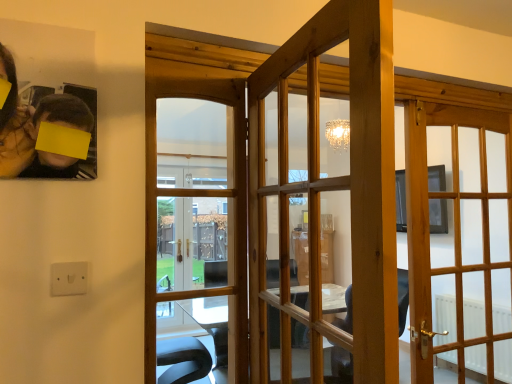
What is the approximate height of white plastic electric outlet at lower left?

The height of white plastic electric outlet at lower left is 3.66 inches.

Locate an element on the screen. wooden glass door at center, arranged as the 1th door when viewed from the left is located at coordinates (196, 232).

Describe the element at coordinates (460, 240) in the screenshot. I see `light wood door at right, which is the third door in left-to-right order` at that location.

You are a GUI agent. You are given a task and a screenshot of the screen. Output one action in this format:
    pyautogui.click(x=<x>, y=<y>)
    Task: Click on the light wood door at right, acting as the 1th door starting from the right
    Image resolution: width=512 pixels, height=384 pixels.
    Given the screenshot: What is the action you would take?
    pyautogui.click(x=460, y=240)

The width and height of the screenshot is (512, 384). Find the location of `white plastic electric outlet at lower left`. white plastic electric outlet at lower left is located at coordinates click(x=69, y=278).

Considering the positions of objects white plastic electric outlet at lower left and light wood door at right, placed as the 1th door when sorted from back to front, in the image provided, who is more to the left, white plastic electric outlet at lower left or light wood door at right, placed as the 1th door when sorted from back to front,?

white plastic electric outlet at lower left is more to the left.

Where is `electric outlet on the left side of light wood door at right, placed as the 1th door when sorted from back to front`? electric outlet on the left side of light wood door at right, placed as the 1th door when sorted from back to front is located at coordinates (69, 278).

From the image's perspective, would you say white plastic electric outlet at lower left is shown under light wood door at right, which ranks as the 3th door in front-to-back order?

No, from the image's perspective, white plastic electric outlet at lower left is not below light wood door at right, which ranks as the 3th door in front-to-back order.

Is wooden glass door at center, which is the 2th door in left-to-right order, surrounded by light wood door at right, which ranks as the 3th door in front-to-back order?

No, wooden glass door at center, which is the 2th door in left-to-right order, is not a part of light wood door at right, which ranks as the 3th door in front-to-back order.

Which door is the 1st one when counting from the left side of the light wood door at right, acting as the 1th door starting from the right? Please provide its 2D coordinates.

[(377, 206)]

Which is farther from the camera, [493,173] or [317,175]?

The point [493,173] is behind.

Is wooden glass door at center, the 2th door from the front, at the left side of wooden glass door at center, acting as the second door starting from the right?

Indeed, wooden glass door at center, the 2th door from the front, is positioned on the left side of wooden glass door at center, acting as the second door starting from the right.

Who is taller, wooden glass door at center, which appears as the 3th door when viewed from the right, or wooden glass door at center, which is the 1th door in front-to-back order?

wooden glass door at center, which appears as the 3th door when viewed from the right, is taller.

Does wooden glass door at center, marked as the 2th door in a back-to-front arrangement, turn towards wooden glass door at center, acting as the second door starting from the right?

Yes, wooden glass door at center, marked as the 2th door in a back-to-front arrangement, is oriented towards wooden glass door at center, acting as the second door starting from the right.

Considering the points (70, 288) and (292, 367), which point is behind, point (70, 288) or point (292, 367)?

The point (292, 367) is farther.

Is white plastic electric outlet at lower left taller than wooden glass door at center, acting as the second door starting from the right?

No.

Is white plastic electric outlet at lower left positioned with its back to wooden glass door at center, which is the 1th door in front-to-back order?

white plastic electric outlet at lower left does not have its back to wooden glass door at center, which is the 1th door in front-to-back order.

Which door is the 1st one when counting from the front of the light wood door at right, which ranks as the 3th door in front-to-back order? Please provide its 2D coordinates.

[(196, 232)]

From the image's perspective, is wooden glass door at center, arranged as the 1th door when viewed from the left, positioned above or below light wood door at right, which is the third door in left-to-right order?

Clearly, from the image's perspective, wooden glass door at center, arranged as the 1th door when viewed from the left, is above light wood door at right, which is the third door in left-to-right order.

Considering the positions of points (150, 362) and (451, 283), is point (150, 362) closer to camera compared to point (451, 283)?

That is True.

Which object is closer to the camera taking this photo, wooden glass door at center, marked as the 2th door in a back-to-front arrangement, or light wood door at right, which is the third door in left-to-right order?

wooden glass door at center, marked as the 2th door in a back-to-front arrangement, is more forward.

In the image, is wooden glass door at center, which appears as the third door when viewed from the back, positioned in front of or behind light wood door at right, which is the third door in left-to-right order?

wooden glass door at center, which appears as the third door when viewed from the back, is positioned closer to the viewer than light wood door at right, which is the third door in left-to-right order.

Could you measure the distance between wooden glass door at center, which appears as the third door when viewed from the back, and light wood door at right, which is the third door in left-to-right order?

wooden glass door at center, which appears as the third door when viewed from the back, is 2.91 centimeters away from light wood door at right, which is the third door in left-to-right order.

From the image's perspective, is wooden glass door at center, which appears as the third door when viewed from the back, beneath light wood door at right, placed as the 1th door when sorted from back to front?

No.

Is wooden glass door at center, which is the 1th door in front-to-back order, aimed at light wood door at right, acting as the 1th door starting from the right?

Yes, wooden glass door at center, which is the 1th door in front-to-back order, is facing light wood door at right, acting as the 1th door starting from the right.

Can you confirm if green matte plant at upper left is bigger than wooden glass door at center, marked as the 2th door in a back-to-front arrangement?

No.

Image resolution: width=512 pixels, height=384 pixels. What are the coordinates of `the 1st door positioned below the green matte plant at upper left (from the image's perspective)` in the screenshot? It's located at (196, 232).

Between green matte plant at upper left and wooden glass door at center, marked as the 2th door in a back-to-front arrangement, which one has less height?

With less height is green matte plant at upper left.

Starting from the white plastic electric outlet at lower left, which door is the 3rd one to the right? Please provide its 2D coordinates.

[(460, 240)]

Image resolution: width=512 pixels, height=384 pixels. There is a light wood door at right, which is the third door in left-to-right order. What are the coordinates of `the 1st door above it (from the image's perspective)` in the screenshot? It's located at (377, 206).

Which object lies further to the anchor point white plastic electric outlet at lower left, light wood door at right, acting as the 1th door starting from the right, or green matte plant at upper left?

light wood door at right, acting as the 1th door starting from the right, is positioned further to the anchor white plastic electric outlet at lower left.

Which object lies nearer to the anchor point green matte plant at upper left, wooden glass door at center, marked as the 2th door in a back-to-front arrangement, or wooden glass door at center, which is the 1th door in front-to-back order?

wooden glass door at center, which is the 1th door in front-to-back order.

From the image, which object appears to be nearer to green matte plant at upper left, wooden glass door at center, which appears as the third door when viewed from the back, or white plastic electric outlet at lower left?

white plastic electric outlet at lower left.

When comparing their distances from wooden glass door at center, which appears as the 3th door when viewed from the right, does light wood door at right, placed as the 1th door when sorted from back to front, or wooden glass door at center, acting as the second door starting from the right, seem further?

wooden glass door at center, acting as the second door starting from the right, is further to wooden glass door at center, which appears as the 3th door when viewed from the right.

Estimate the real-world distances between objects in this image. Which object is further from light wood door at right, placed as the 1th door when sorted from back to front, wooden glass door at center, arranged as the 1th door when viewed from the left, or green matte plant at upper left?

wooden glass door at center, arranged as the 1th door when viewed from the left, lies further to light wood door at right, placed as the 1th door when sorted from back to front, than the other object.

Which object lies further to the anchor point white plastic electric outlet at lower left, wooden glass door at center, which appears as the third door when viewed from the back, or wooden glass door at center, the 2th door from the front?

wooden glass door at center, the 2th door from the front, lies further to white plastic electric outlet at lower left than the other object.

From the picture: From the image, which object appears to be farther from wooden glass door at center, which is the 1th door in front-to-back order, green matte plant at upper left or white plastic electric outlet at lower left?

The object further to wooden glass door at center, which is the 1th door in front-to-back order, is white plastic electric outlet at lower left.

Estimate the real-world distances between objects in this image. Which object is further from light wood door at right, which is the third door in left-to-right order, wooden glass door at center, which is the 1th door in front-to-back order, or white plastic electric outlet at lower left?

white plastic electric outlet at lower left is positioned further to the anchor light wood door at right, which is the third door in left-to-right order.

The width and height of the screenshot is (512, 384). What are the coordinates of `electric outlet situated between green matte plant at upper left and wooden glass door at center, acting as the second door starting from the right, from left to right` in the screenshot? It's located at (69, 278).

You are a GUI agent. You are given a task and a screenshot of the screen. Output one action in this format:
    pyautogui.click(x=<x>, y=<y>)
    Task: Click on the electric outlet located between green matte plant at upper left and light wood door at right, which is the third door in left-to-right order, in the left-right direction
    The image size is (512, 384).
    Given the screenshot: What is the action you would take?
    pyautogui.click(x=69, y=278)

Locate an element on the screen. Image resolution: width=512 pixels, height=384 pixels. door located between wooden glass door at center, marked as the 2th door in a back-to-front arrangement, and light wood door at right, acting as the 1th door starting from the right, in the left-right direction is located at coordinates (377, 206).

Where is `door between white plastic electric outlet at lower left and wooden glass door at center, acting as the second door starting from the right`? Image resolution: width=512 pixels, height=384 pixels. door between white plastic electric outlet at lower left and wooden glass door at center, acting as the second door starting from the right is located at coordinates (196, 232).